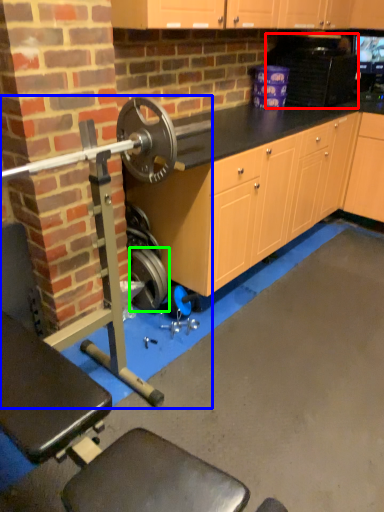
Question: Considering the real-world distances, which object is closest to appliance (highlighted by a red box)? barbell (highlighted by a blue box) or wheel (highlighted by a green box).

Choices:
 (A) barbell
 (B) wheel

Answer: (A)